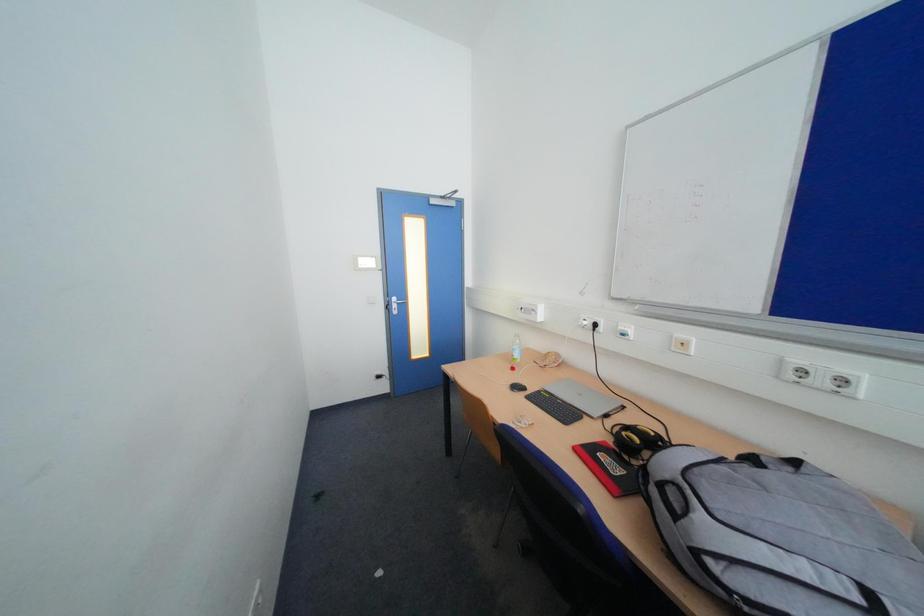
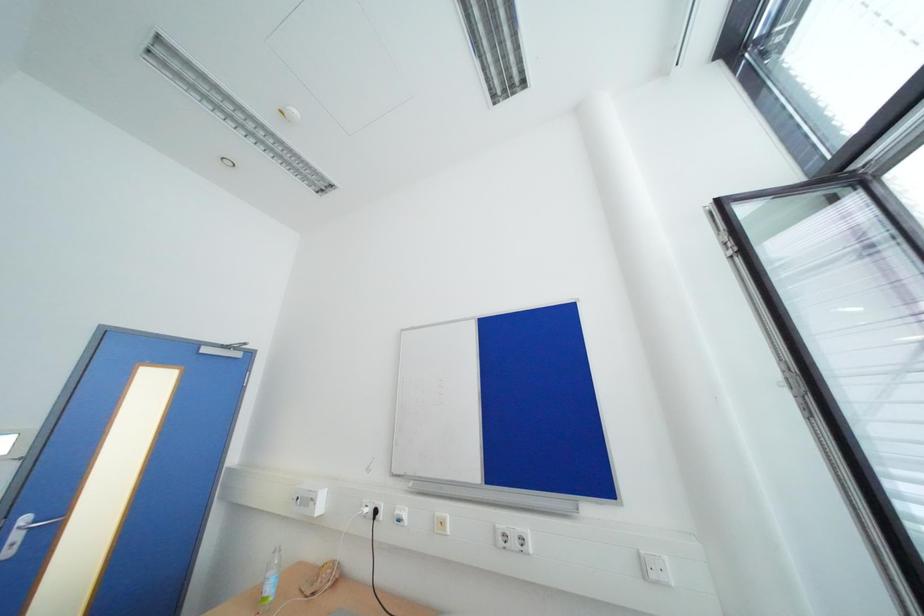
The first image is from the beginning of the video and the second image is from the end. How did the camera likely rotate when shooting the video?

The rotation direction of the camera is right-up.